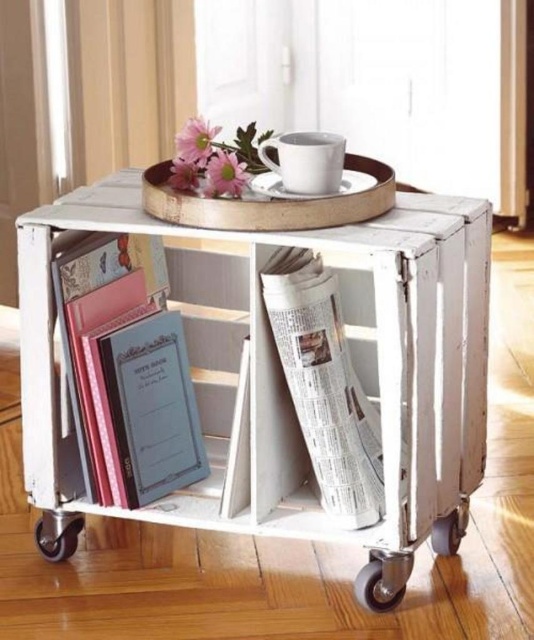
Question: Considering the relative positions of matte blue notebook at left and black rubber wheel at lower left in the image provided, where is matte blue notebook at left located with respect to black rubber wheel at lower left?

Choices:
 (A) left
 (B) right

Answer: (B)

Question: Estimate the real-world distances between objects in this image. Which object is farther from the black rubber wheel at lower right?

Choices:
 (A) black rubber wheel at lower left
 (B) metallic gray wheel at lower center
 (C) matte blue notebook at left
 (D) white paper newspaper at center

Answer: (C)

Question: Considering the relative positions of black rubber wheel at lower left and metallic gray wheel at lower center in the image provided, where is black rubber wheel at lower left located with respect to metallic gray wheel at lower center?

Choices:
 (A) left
 (B) right

Answer: (A)

Question: Is white paper newspaper at center behind black rubber wheel at lower left?

Choices:
 (A) yes
 (B) no

Answer: (B)

Question: Based on their relative distances, which object is farther from the white paper newspaper at center?

Choices:
 (A) black rubber wheel at lower left
 (B) black rubber wheel at lower right
 (C) metallic gray wheel at lower center

Answer: (A)

Question: Which object appears closest to the camera in this image?

Choices:
 (A) matte blue notebook at left
 (B) black rubber wheel at lower left
 (C) black rubber wheel at lower right
 (D) metallic gray wheel at lower center

Answer: (C)